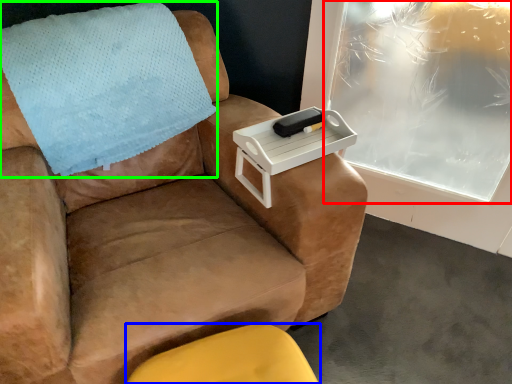
Question: Estimate the real-world distances between objects in this image. Which object is farther from window screen (highlighted by a red box), furniture (highlighted by a blue box) or blanket (highlighted by a green box)?

Choices:
 (A) furniture
 (B) blanket

Answer: (A)